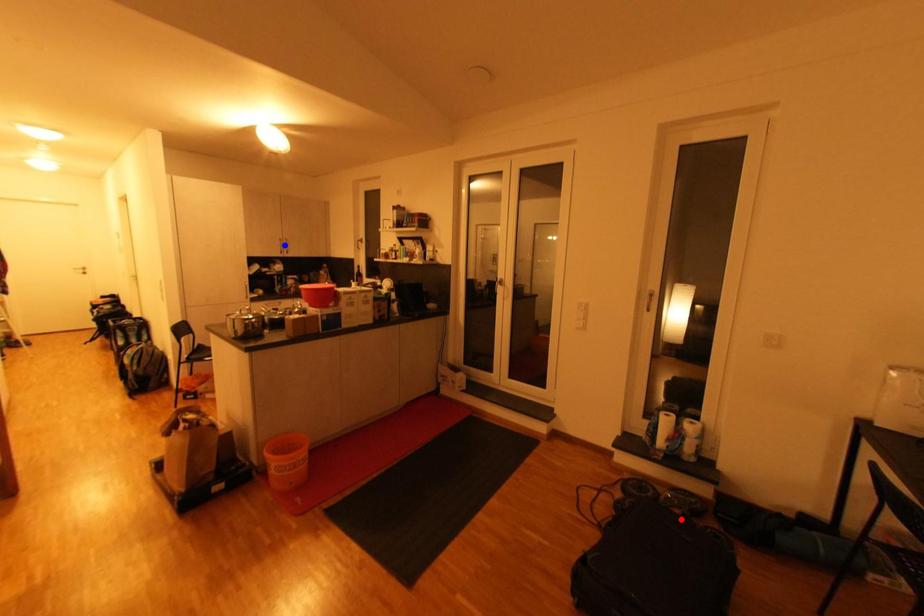
Question: Which of the two points in the image is closer to the camera?

Choices:
 (A) Blue point is closer.
 (B) Red point is closer.

Answer: (B)